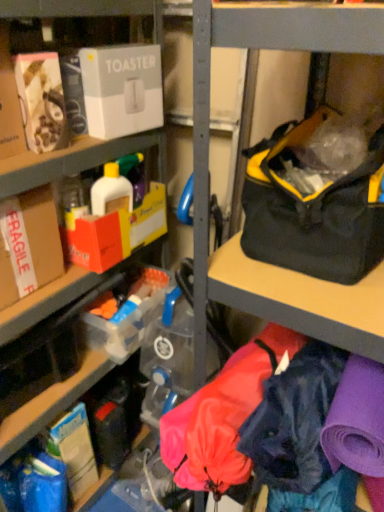
Question: Is point (140, 8) positioned closer to the camera than point (145, 67)?

Choices:
 (A) closer
 (B) farther

Answer: (B)

Question: From the image's perspective, is matte black toaster at upper left positioned above or below white cardboard toaster at upper left, the second box positioned from the bottom?

Choices:
 (A) above
 (B) below

Answer: (B)

Question: Estimate the real-world distances between objects in this image. Which object is farther from the brown cardboard box at left, which is the first box from left to right?

Choices:
 (A) black/yellow fabric bag at right
 (B) white cardboard toaster at upper left, the second box positioned from the bottom
 (C) matte black toaster at upper left

Answer: (A)

Question: Estimate the real-world distances between objects in this image. Which object is closer to the brown cardboard box at left, positioned as the first box in bottom-to-top order?

Choices:
 (A) black/yellow fabric bag at right
 (B) matte black toaster at upper left
 (C) white cardboard toaster at upper left, arranged as the first box when viewed from the top

Answer: (B)